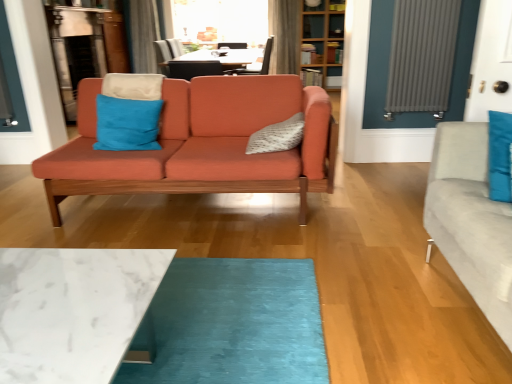
Question: Considering the relative sizes of blue suede pillow at center, the first pillow when ordered from left to right, and silky gray curtain at upper center, which is the second curtain in right-to-left order, in the image provided, is blue suede pillow at center, the first pillow when ordered from left to right, taller than silky gray curtain at upper center, which is the second curtain in right-to-left order,?

Choices:
 (A) no
 (B) yes

Answer: (A)

Question: Is blue suede pillow at center, arranged as the 2th pillow when viewed from the right, positioned with its back to silky gray curtain at upper center, the first curtain viewed from the left?

Choices:
 (A) no
 (B) yes

Answer: (B)

Question: From a real-world perspective, is blue suede pillow at center, the first pillow when ordered from left to right, below silky gray curtain at upper center, the first curtain viewed from the left?

Choices:
 (A) no
 (B) yes

Answer: (B)

Question: Is blue suede pillow at center, the first pillow when ordered from left to right, in contact with silky gray curtain at upper center, the first curtain viewed from the left?

Choices:
 (A) yes
 (B) no

Answer: (B)

Question: Would you say blue suede pillow at center, the first pillow when ordered from left to right, is outside silky gray curtain at upper center, the first curtain viewed from the left?

Choices:
 (A) yes
 (B) no

Answer: (A)

Question: Is white marble coffee table at lower center situated inside matte orange couch at center or outside?

Choices:
 (A) outside
 (B) inside

Answer: (A)

Question: In terms of width, does white marble coffee table at lower center look wider or thinner when compared to matte orange couch at center?

Choices:
 (A) thin
 (B) wide

Answer: (A)

Question: Is white marble coffee table at lower center in front of or behind matte orange couch at center in the image?

Choices:
 (A) front
 (B) behind

Answer: (A)

Question: In terms of size, does white marble coffee table at lower center appear bigger or smaller than matte orange couch at center?

Choices:
 (A) big
 (B) small

Answer: (B)

Question: Considering the positions of point (163, 72) and point (280, 6), is point (163, 72) closer or farther from the camera than point (280, 6)?

Choices:
 (A) closer
 (B) farther

Answer: (A)

Question: In the image, is silky gray curtain at upper center, the first curtain viewed from the left, on the left side or the right side of velvet gray curtain at upper center, arranged as the second curtain when viewed from the left?

Choices:
 (A) left
 (B) right

Answer: (A)

Question: Is silky gray curtain at upper center, which is the second curtain in right-to-left order, in front of or behind velvet gray curtain at upper center, arranged as the second curtain when viewed from the left, in the image?

Choices:
 (A) behind
 (B) front

Answer: (A)

Question: Considering the positions of silky gray curtain at upper center, which is the second curtain in right-to-left order, and velvet gray curtain at upper center, arranged as the second curtain when viewed from the left, in the image, is silky gray curtain at upper center, which is the second curtain in right-to-left order, taller or shorter than velvet gray curtain at upper center, arranged as the second curtain when viewed from the left,?

Choices:
 (A) tall
 (B) short

Answer: (B)

Question: Based on their positions, is velvet gray curtain at upper center, the first curtain viewed from the right, located to the left or right of blue suede pillow at center, arranged as the 2th pillow when viewed from the right?

Choices:
 (A) right
 (B) left

Answer: (A)

Question: From the image's perspective, relative to blue suede pillow at center, arranged as the 2th pillow when viewed from the right, is velvet gray curtain at upper center, arranged as the second curtain when viewed from the left, above or below?

Choices:
 (A) above
 (B) below

Answer: (A)